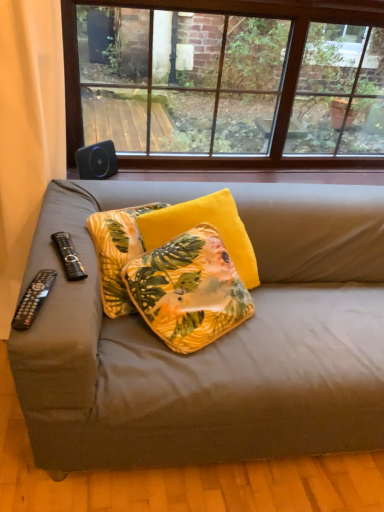
Image resolution: width=384 pixels, height=512 pixels. In order to click on free location in front of black plastic remote at left, the 1th remote control from the top in this screenshot , I will do `click(55, 286)`.